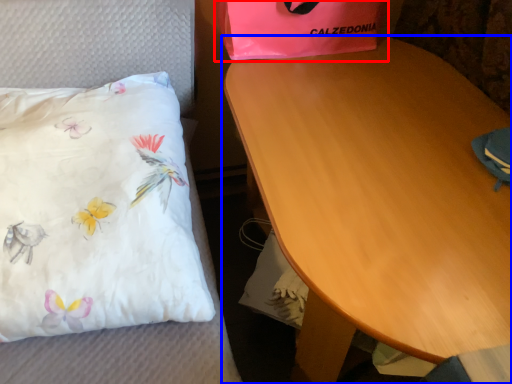
Question: Which point is closer to the camera, gift bag (highlighted by a red box) or table (highlighted by a blue box)?

Choices:
 (A) gift bag
 (B) table

Answer: (B)